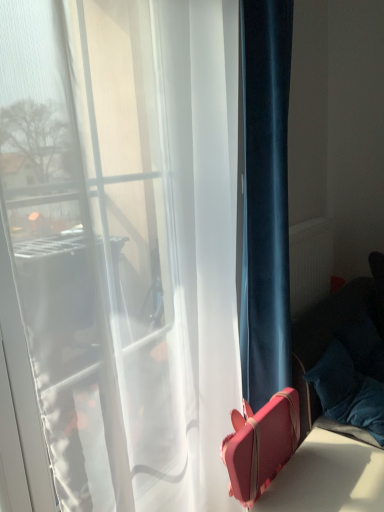
Question: Is matte white radiator at right wider than velvety blue pillow at lower right?

Choices:
 (A) no
 (B) yes

Answer: (A)

Question: Can you confirm if matte white radiator at right is smaller than velvety blue pillow at lower right?

Choices:
 (A) no
 (B) yes

Answer: (B)

Question: From the image's perspective, is matte white radiator at right on velvety blue pillow at lower right?

Choices:
 (A) yes
 (B) no

Answer: (A)

Question: Considering the relative sizes of matte white radiator at right and velvety blue pillow at lower right in the image provided, is matte white radiator at right bigger than velvety blue pillow at lower right?

Choices:
 (A) yes
 (B) no

Answer: (B)

Question: Is matte white radiator at right facing towards velvety blue pillow at lower right?

Choices:
 (A) yes
 (B) no

Answer: (B)

Question: From a real-world perspective, is velvety blue pillow at lower right above or below velvet blue curtain at right?

Choices:
 (A) above
 (B) below

Answer: (B)

Question: Considering the relative positions of velvety blue pillow at lower right and velvet blue curtain at right in the image provided, is velvety blue pillow at lower right to the left or to the right of velvet blue curtain at right?

Choices:
 (A) left
 (B) right

Answer: (B)

Question: From the image's perspective, is velvety blue pillow at lower right above or below velvet blue curtain at right?

Choices:
 (A) above
 (B) below

Answer: (B)

Question: Considering the positions of point (344, 398) and point (288, 371), is point (344, 398) closer or farther from the camera than point (288, 371)?

Choices:
 (A) farther
 (B) closer

Answer: (A)

Question: Based on their sizes in the image, would you say velvety blue pillow at lower right is bigger or smaller than pink leather suitcase at lower right?

Choices:
 (A) big
 (B) small

Answer: (B)

Question: Is velvety blue pillow at lower right taller or shorter than pink leather suitcase at lower right?

Choices:
 (A) tall
 (B) short

Answer: (B)

Question: Which is correct: velvety blue pillow at lower right is inside pink leather suitcase at lower right, or outside of it?

Choices:
 (A) inside
 (B) outside

Answer: (B)

Question: Considering the positions of point (334, 364) and point (322, 449), is point (334, 364) closer or farther from the camera than point (322, 449)?

Choices:
 (A) farther
 (B) closer

Answer: (A)

Question: Does point (326, 294) appear closer or farther from the camera than point (284, 154)?

Choices:
 (A) farther
 (B) closer

Answer: (A)

Question: In terms of size, does matte white radiator at right appear bigger or smaller than velvet blue curtain at right?

Choices:
 (A) small
 (B) big

Answer: (A)